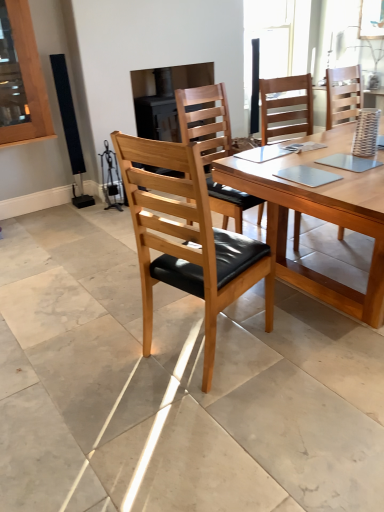
At what (x,y) coordinates should I click in order to perform the action: click on free location to the right of natural wood/black leather chair at center, the first chair from the left. Please return your answer as a coordinate pair (x, y). This screenshot has height=512, width=384. Looking at the image, I should click on (297, 344).